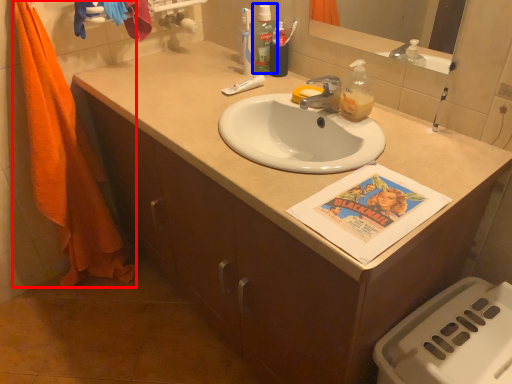
Question: Which of the following is the farthest to the observer, beach towel (highlighted by a red box) or mouthwash (highlighted by a blue box)?

Choices:
 (A) beach towel
 (B) mouthwash

Answer: (B)